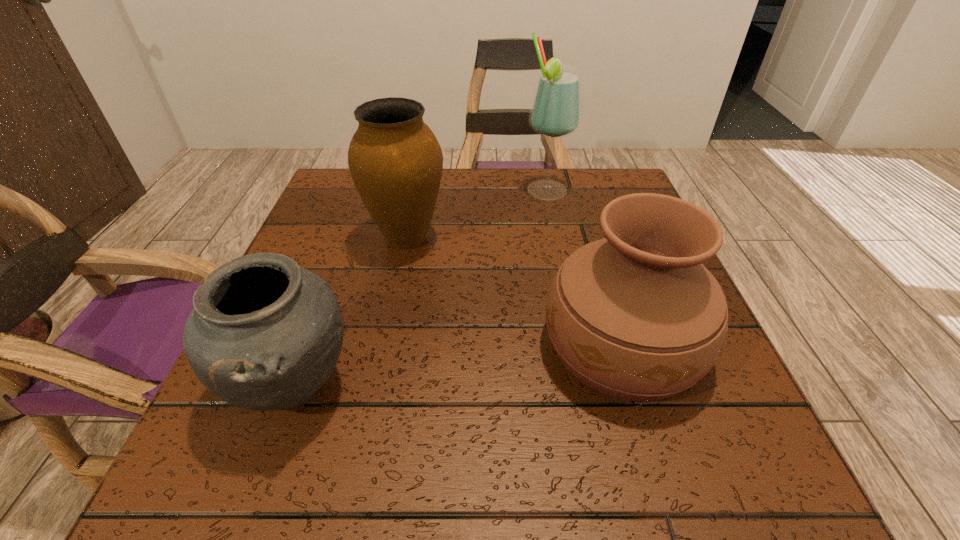
Where is `the farthest object`? the farthest object is located at coordinates (556, 111).

The height and width of the screenshot is (540, 960). Identify the location of alcohol. (556, 111).

The width and height of the screenshot is (960, 540). Find the location of `the second farthest object`. the second farthest object is located at coordinates (396, 163).

Locate an element on the screen. Image resolution: width=960 pixels, height=540 pixels. the rightmost urn is located at coordinates (636, 315).

This screenshot has width=960, height=540. Identify the location of the shortest object. (264, 334).

Locate an element on the screen. This screenshot has width=960, height=540. vacant space located on the left of the farthest object is located at coordinates (436, 191).

Identify the location of free space located on the right of the second farthest object. (517, 238).

Locate an element on the screen. This screenshot has height=540, width=960. vacant space positioned on the front of the rightmost urn is located at coordinates (665, 489).

Where is `free location located 0.400m on the right of the shortest urn`? free location located 0.400m on the right of the shortest urn is located at coordinates (622, 386).

Where is `alcohol located in the far edge section of the desktop`? alcohol located in the far edge section of the desktop is located at coordinates (556, 111).